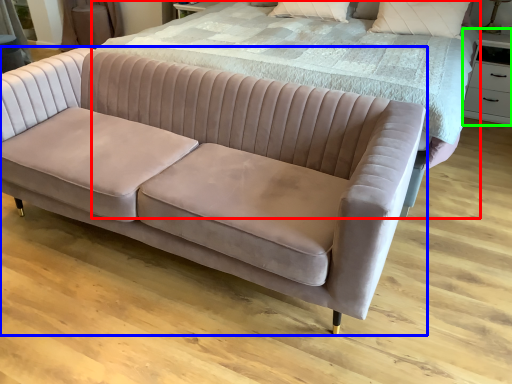
Question: Considering the real-world distances, which object is closest to bed (highlighted by a red box)? studio couch (highlighted by a blue box) or side table (highlighted by a green box).

Choices:
 (A) studio couch
 (B) side table

Answer: (A)